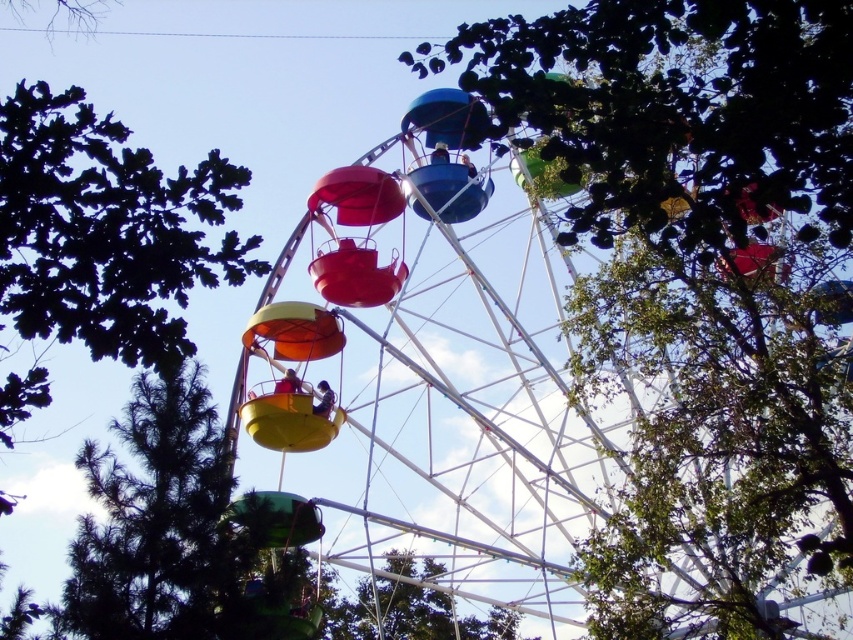
You are standing in a park and see the metallic ferris wheel at center and the dark green leafy tree at lower left. Which object takes up more space in the scene?

The metallic ferris wheel at center takes up more space in the scene because it is bigger than the dark green leafy tree at lower left.

You are standing in front of the Ferris wheel and want to take a photo that includes both the dark green leafy tree at lower left and the green leafy tree at center. Which tree should you position closer to the front of your photo to ensure both are fully visible?

The dark green leafy tree at lower left is taller than the green leafy tree at center, so you should position the dark green leafy tree at lower left closer to the front of your photo to ensure both are fully visible without the taller tree blocking the shorter one.